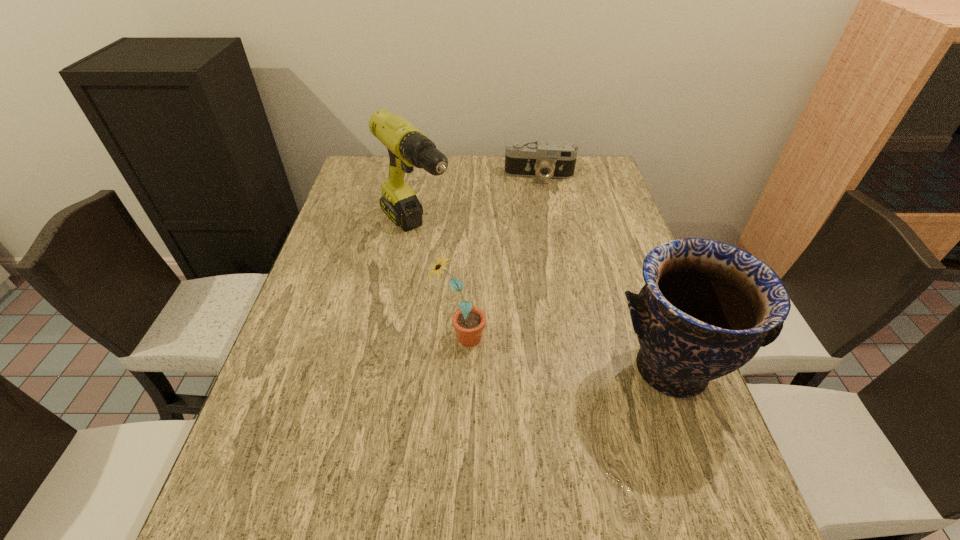
Where is `free space located on the handle side of the tallest object`? free space located on the handle side of the tallest object is located at coordinates (461, 282).

Locate an element on the screen. free region located on the lens of the shortest object is located at coordinates (538, 224).

Where is `free space located on the lens of the shortest object`? This screenshot has height=540, width=960. free space located on the lens of the shortest object is located at coordinates (538, 236).

This screenshot has width=960, height=540. Find the location of `vacant point located on the lens of the shortest object`. vacant point located on the lens of the shortest object is located at coordinates (538, 214).

Where is `object located in the far edge section of the desktop`? The image size is (960, 540). object located in the far edge section of the desktop is located at coordinates (553, 159).

Where is `object that is at the left edge`? The height and width of the screenshot is (540, 960). object that is at the left edge is located at coordinates [x=407, y=146].

In order to click on pottery that is positioned at the right edge in this screenshot , I will do `click(707, 307)`.

The height and width of the screenshot is (540, 960). Identify the location of camera that is at the right edge. click(x=553, y=159).

Locate an element on the screen. The height and width of the screenshot is (540, 960). object located in the far right corner section of the desktop is located at coordinates (553, 159).

You are a GUI agent. You are given a task and a screenshot of the screen. Output one action in this format:
    pyautogui.click(x=<x>, y=<y>)
    Task: Click on the free region at the far edge of the desktop
    Image resolution: width=960 pixels, height=540 pixels.
    Given the screenshot: What is the action you would take?
    pyautogui.click(x=510, y=183)